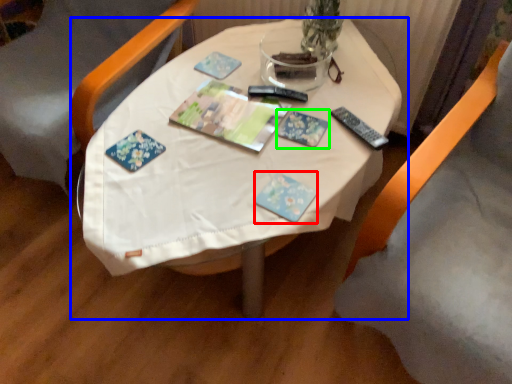
Question: Which is farther away from paperback book (highlighted by a red box)? table (highlighted by a blue box) or paperback book (highlighted by a green box)?

Choices:
 (A) table
 (B) paperback book

Answer: (A)